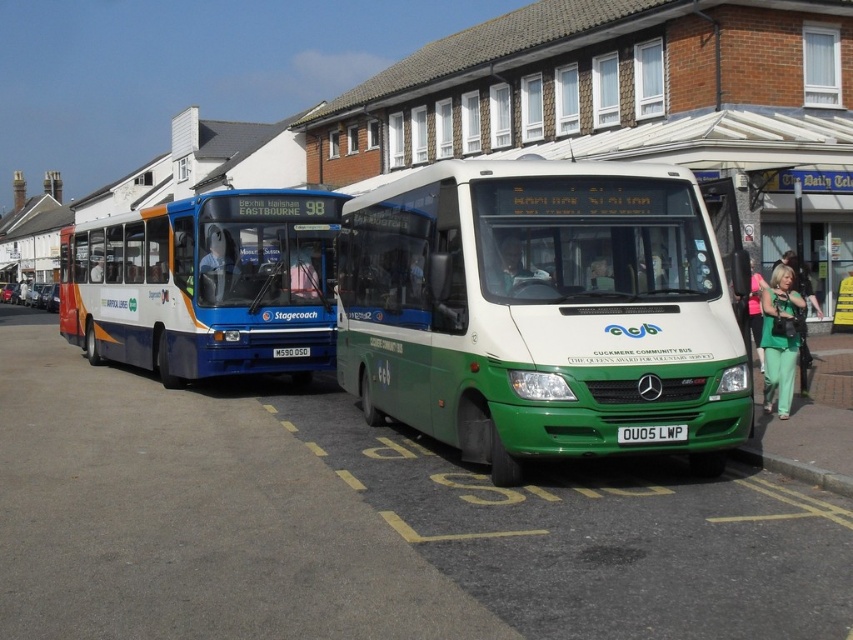
You are a delivery driver who needs to read the license plates of both buses parked at the bus stop. Which license plate is positioned lower between the white plastic license plate at center and the black plastic license plate at center?

The white plastic license plate at center is located below the black plastic license plate at center, so the white plastic license plate at center is positioned lower.

You are a pedestrian standing at the bus stop. You see the blue metallic bus at center and the white plastic license plate at center. Which object is closer to your left side?

The blue metallic bus at center is to the left of the white plastic license plate at center, so it is closer to your left side.